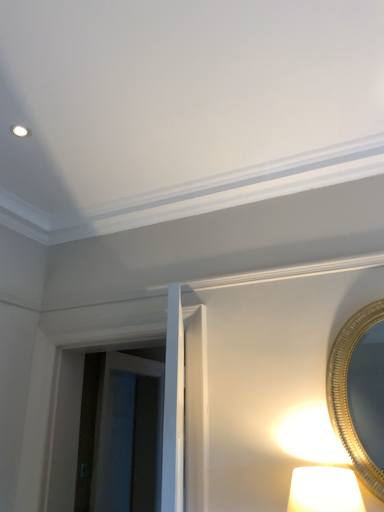
Question: Considering the relative positions of transparent glass door at center and gold metallic mirror at right in the image provided, is transparent glass door at center to the right of gold metallic mirror at right from the viewer's perspective?

Choices:
 (A) yes
 (B) no

Answer: (B)

Question: Considering the relative sizes of transparent glass door at center and gold metallic mirror at right in the image provided, is transparent glass door at center thinner than gold metallic mirror at right?

Choices:
 (A) no
 (B) yes

Answer: (A)

Question: Considering the relative positions of transparent glass door at center and gold metallic mirror at right in the image provided, is transparent glass door at center to the left of gold metallic mirror at right from the viewer's perspective?

Choices:
 (A) yes
 (B) no

Answer: (A)

Question: From the image's perspective, would you say transparent glass door at center is positioned over gold metallic mirror at right?

Choices:
 (A) yes
 (B) no

Answer: (B)

Question: Is transparent glass door at center not close to gold metallic mirror at right?

Choices:
 (A) yes
 (B) no

Answer: (A)

Question: Is transparent glass door at center outside gold metallic mirror at right?

Choices:
 (A) yes
 (B) no

Answer: (A)

Question: Are gold metallic mirror at right and transparent glass door at center beside each other?

Choices:
 (A) yes
 (B) no

Answer: (B)

Question: Does gold metallic mirror at right have a smaller size compared to transparent glass door at center?

Choices:
 (A) no
 (B) yes

Answer: (B)

Question: From the image's perspective, does gold metallic mirror at right appear lower than transparent glass door at center?

Choices:
 (A) yes
 (B) no

Answer: (B)

Question: Is gold metallic mirror at right shorter than transparent glass door at center?

Choices:
 (A) yes
 (B) no

Answer: (A)

Question: Does gold metallic mirror at right appear on the right side of transparent glass door at center?

Choices:
 (A) yes
 (B) no

Answer: (A)

Question: Considering the relative sizes of gold metallic mirror at right and transparent glass door at center in the image provided, is gold metallic mirror at right bigger than transparent glass door at center?

Choices:
 (A) yes
 (B) no

Answer: (B)

Question: Is gold metallic mirror at right to the left or to the right of transparent glass door at center in the image?

Choices:
 (A) left
 (B) right

Answer: (B)